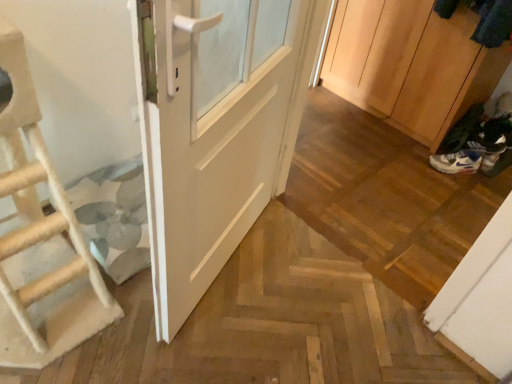
Question: Does white matte door at center have a lesser width compared to white leather shoe at lower right?

Choices:
 (A) yes
 (B) no

Answer: (A)

Question: Can you confirm if white matte door at center is smaller than white leather shoe at lower right?

Choices:
 (A) no
 (B) yes

Answer: (A)

Question: Could white leather shoe at lower right be considered to be inside white matte door at center?

Choices:
 (A) no
 (B) yes

Answer: (A)

Question: Is white leather shoe at lower right at the back of white matte door at center?

Choices:
 (A) no
 (B) yes

Answer: (A)

Question: Is white matte door at center wider than white leather shoe at lower right?

Choices:
 (A) no
 (B) yes

Answer: (A)

Question: From a real-world perspective, is white matte door at center physically below white leather shoe at lower right?

Choices:
 (A) no
 (B) yes

Answer: (A)

Question: Is wooden cabinet at right positioned with its back to white mesh shoe at lower right?

Choices:
 (A) yes
 (B) no

Answer: (B)

Question: Considering the relative positions of wooden cabinet at right and white mesh shoe at lower right in the image provided, is wooden cabinet at right in front of white mesh shoe at lower right?

Choices:
 (A) yes
 (B) no

Answer: (A)

Question: Could you tell me if wooden cabinet at right is facing white mesh shoe at lower right?

Choices:
 (A) no
 (B) yes

Answer: (A)

Question: Are wooden cabinet at right and white mesh shoe at lower right beside each other?

Choices:
 (A) no
 (B) yes

Answer: (A)

Question: Is wooden cabinet at right positioned behind white mesh shoe at lower right?

Choices:
 (A) yes
 (B) no

Answer: (B)

Question: Is wooden cabinet at right taller than white mesh shoe at lower right?

Choices:
 (A) yes
 (B) no

Answer: (A)

Question: From the image's perspective, does wooden cabinet at right appear lower than beige rope ladder at left?

Choices:
 (A) no
 (B) yes

Answer: (A)